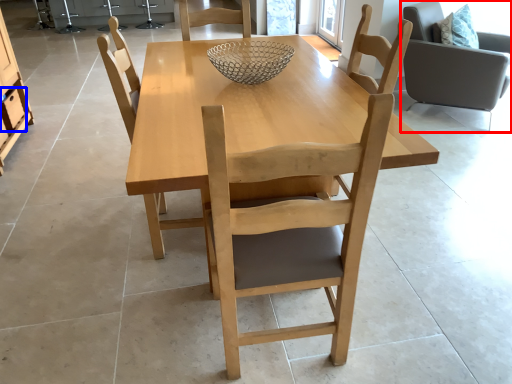
Question: Which of the following is the closest to the observer, chair (highlighted by a red box) or drawer (highlighted by a blue box)?

Choices:
 (A) chair
 (B) drawer

Answer: (A)